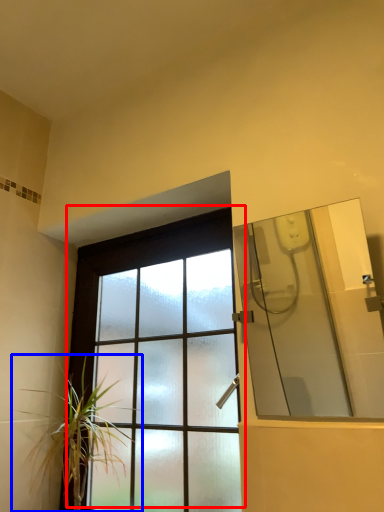
Question: Which object is closer to the camera taking this photo, window (highlighted by a red box) or houseplant (highlighted by a blue box)?

Choices:
 (A) window
 (B) houseplant

Answer: (A)